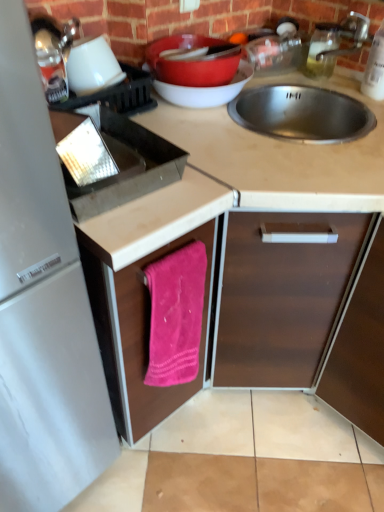
Question: Considering the relative sizes of silver metallic faucet at upper right and pink fabric towel at lower center, marked as the 1th cabinetry in a left-to-right arrangement, in the image provided, is silver metallic faucet at upper right taller than pink fabric towel at lower center, marked as the 1th cabinetry in a left-to-right arrangement,?

Choices:
 (A) no
 (B) yes

Answer: (A)

Question: Is pink fabric towel at lower center, marked as the 1th cabinetry in a left-to-right arrangement, at the back of silver metallic faucet at upper right?

Choices:
 (A) yes
 (B) no

Answer: (B)

Question: Is silver metallic faucet at upper right completely or partially outside of pink fabric towel at lower center, marked as the 1th cabinetry in a left-to-right arrangement?

Choices:
 (A) yes
 (B) no

Answer: (A)

Question: From a real-world perspective, is silver metallic faucet at upper right positioned over pink fabric towel at lower center, marked as the 1th cabinetry in a left-to-right arrangement, based on gravity?

Choices:
 (A) yes
 (B) no

Answer: (A)

Question: Is the depth of silver metallic faucet at upper right greater than that of pink fabric towel at lower center, which is the second cabinetry in right-to-left order?

Choices:
 (A) yes
 (B) no

Answer: (A)

Question: Considering the positions of silver metallic faucet at upper right and metallic silver kettle at upper left, the 2th appliance in the right-to-left sequence, in the image, is silver metallic faucet at upper right bigger or smaller than metallic silver kettle at upper left, the 2th appliance in the right-to-left sequence,?

Choices:
 (A) big
 (B) small

Answer: (B)

Question: Does point (326, 54) appear closer or farther from the camera than point (66, 56)?

Choices:
 (A) closer
 (B) farther

Answer: (B)

Question: Visually, is silver metallic faucet at upper right positioned to the left or to the right of metallic silver kettle at upper left, the 2th appliance in the right-to-left sequence?

Choices:
 (A) left
 (B) right

Answer: (B)

Question: Is silver metallic faucet at upper right in front of or behind metallic silver kettle at upper left, the 1th appliance from the left, in the image?

Choices:
 (A) front
 (B) behind

Answer: (B)

Question: From the image's perspective, is pink fabric towel at lower center, marked as the 1th cabinetry in a left-to-right arrangement, positioned above or below brown matte cabinet at center, which appears as the second cabinetry when viewed from the left?

Choices:
 (A) above
 (B) below

Answer: (A)

Question: Is pink fabric towel at lower center, marked as the 1th cabinetry in a left-to-right arrangement, bigger or smaller than brown matte cabinet at center, which appears as the second cabinetry when viewed from the left?

Choices:
 (A) big
 (B) small

Answer: (B)

Question: Considering the positions of point (125, 382) and point (357, 395), is point (125, 382) closer or farther from the camera than point (357, 395)?

Choices:
 (A) farther
 (B) closer

Answer: (B)

Question: In the image, is pink fabric towel at lower center, which is the second cabinetry in right-to-left order, positioned in front of or behind brown matte cabinet at center, which appears as the second cabinetry when viewed from the left?

Choices:
 (A) front
 (B) behind

Answer: (B)

Question: Considering their positions, is white matte cup at upper left, the second appliance viewed from the left, located in front of or behind metallic silver kettle at upper left, the 1th appliance from the left?

Choices:
 (A) behind
 (B) front

Answer: (A)

Question: From the image's perspective, relative to metallic silver kettle at upper left, the 2th appliance in the right-to-left sequence, is white matte cup at upper left, the second appliance viewed from the left, above or below?

Choices:
 (A) above
 (B) below

Answer: (A)